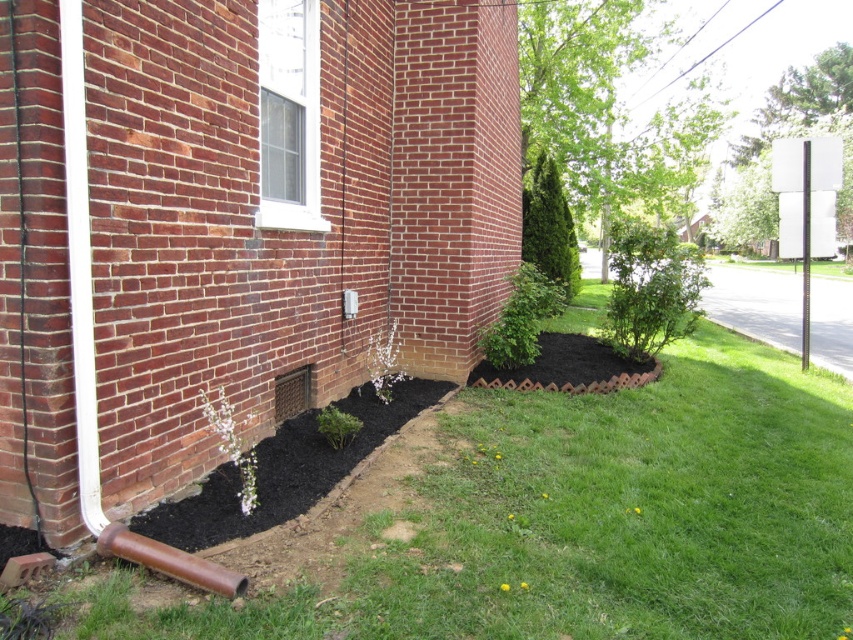
Is green grass at lower center in front of black mulch at lower left?

No, green grass at lower center is further to the viewer.

Is green grass at lower center positioned behind black mulch at lower left?

Yes.

This screenshot has height=640, width=853. What do you see at coordinates (564, 522) in the screenshot? I see `green grass at lower center` at bounding box center [564, 522].

Identify the location of green grass at lower center. Image resolution: width=853 pixels, height=640 pixels. (564, 522).